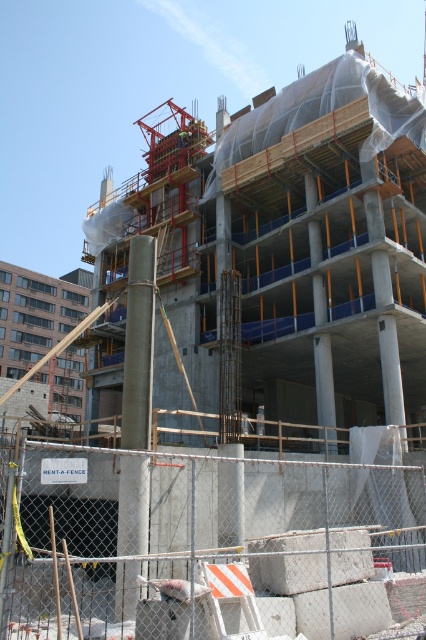
Can you confirm if white concrete blocks at lower center is taller than concrete column at center?

Correct, white concrete blocks at lower center is much taller as concrete column at center.

Can you confirm if white concrete blocks at lower center is positioned below concrete column at center?

Indeed, white concrete blocks at lower center is positioned under concrete column at center.

Is point (123, 596) positioned after point (146, 241)?

No, it is not.

Locate an element on the screen. The image size is (426, 640). white concrete blocks at lower center is located at coordinates (207, 544).